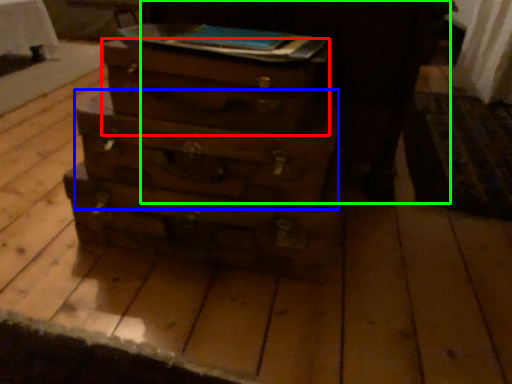
Question: Which object is the closest to the drawer (highlighted by a red box)? Choose among these: drawer (highlighted by a blue box) or dark (highlighted by a green box).

Choices:
 (A) drawer
 (B) dark

Answer: (A)